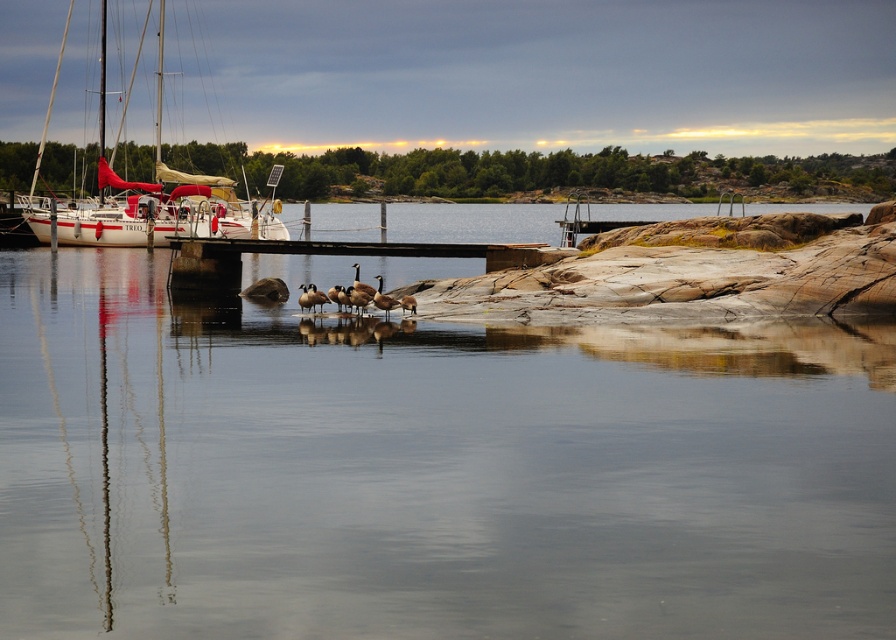
You are a photographer positioned at the lakeside wanting to capture both the white matte sailboat at left and the brown wooden dock at center in a single shot. Which object should you focus on first to ensure both are in clear view?

You should focus on the white matte sailboat at left first because it is closer to you than the brown wooden dock at center, ensuring both are in focus when using a camera with depth of field considerations.

You are a photographer standing at the edge of the lakeside. You want to take a photo that includes both the point at coordinates point[211,193] and point[302,241]. Which point will appear closer to the bottom of your camera viewfinder?

Point[302,241] will appear closer to the bottom of the camera viewfinder because it is closer to the camera than point[211,193].

You are an observer standing on the brown wooden dock at center. You want to board the white matte sailboat at left. Is the sailboat within your immediate reach from the dock?

The white matte sailboat at left is larger in size compared to the brown wooden dock at center. Since the sailboat is docked at the brown wooden dock at center, it is within immediate reach for boarding.